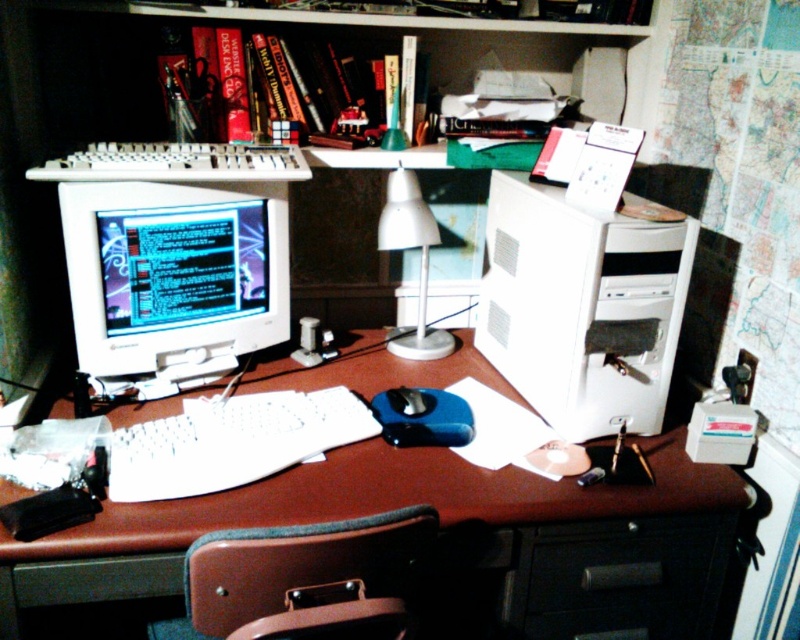
Question: Estimate the real-world distances between objects in this image. Which object is closer to the white plastic lamp at center?

Choices:
 (A) black rubber mouse at center
 (B) white plastic computer tower at right
 (C) brown leather swivel chair at lower center
 (D) white plastic keyboard at center

Answer: (B)

Question: Which object is positioned farthest from the white plastic keyboard at center?

Choices:
 (A) black rubber mouse at center
 (B) matte white monitor at left
 (C) white plastic computer tower at right

Answer: (C)

Question: Does white plastic computer desk at center appear under matte white monitor at left?

Choices:
 (A) yes
 (B) no

Answer: (A)

Question: Is white plastic computer desk at center wider than white plastic lamp at center?

Choices:
 (A) no
 (B) yes

Answer: (B)

Question: Estimate the real-world distances between objects in this image. Which object is closer to the brown leather swivel chair at lower center?

Choices:
 (A) matte white monitor at left
 (B) white plastic computer desk at center
 (C) white plastic lamp at center

Answer: (B)

Question: Is white plastic lamp at center smaller than black rubber mouse at center?

Choices:
 (A) yes
 (B) no

Answer: (B)